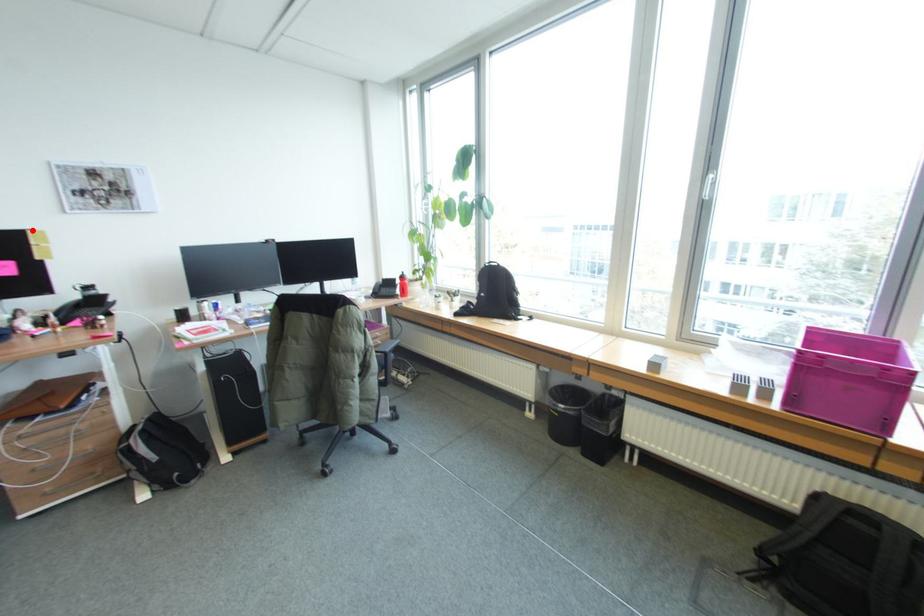
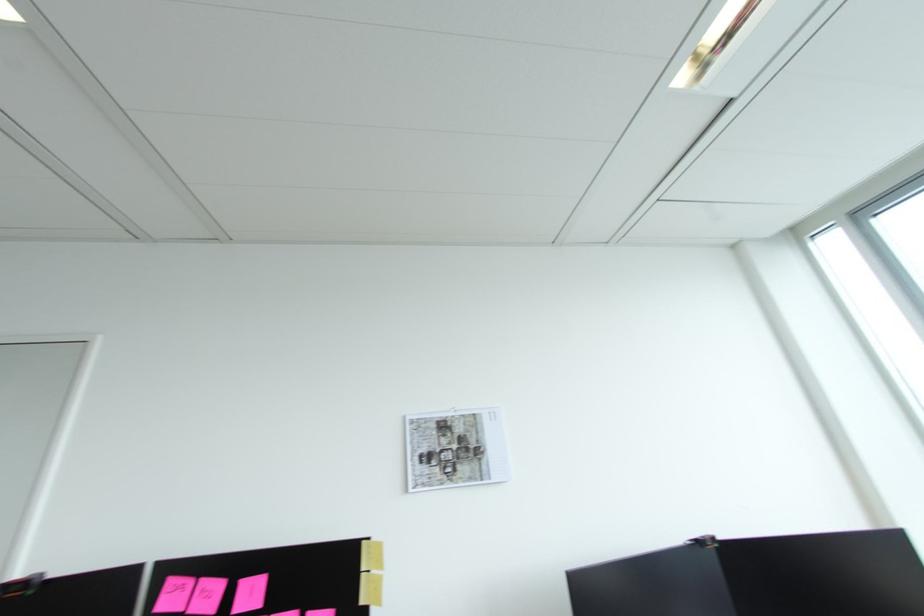
Where in the second image is the point corresponding to the highlighted location from the first image?

(368, 541)